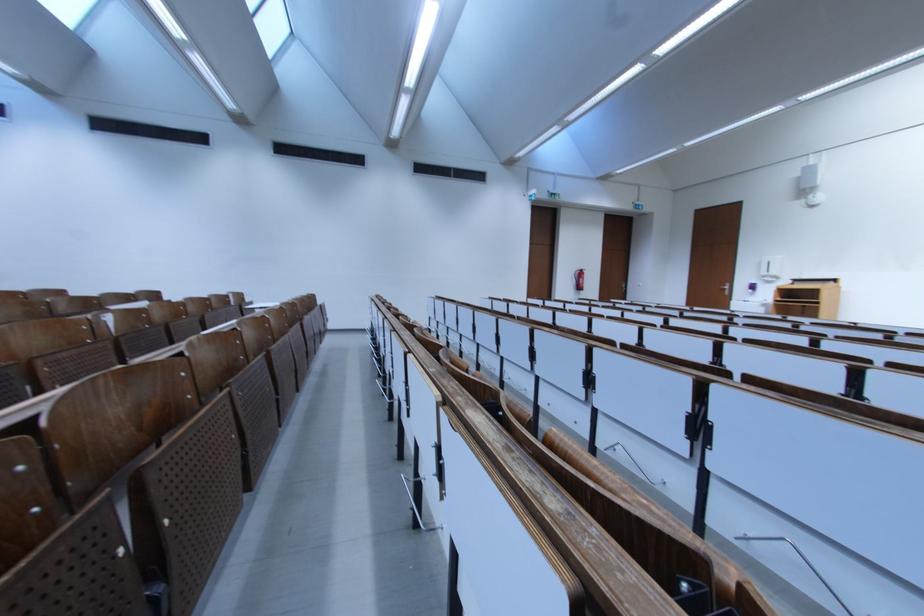
Where would you turn the door handle? Please return your answer as a coordinate pair (x, y).

(724, 288)